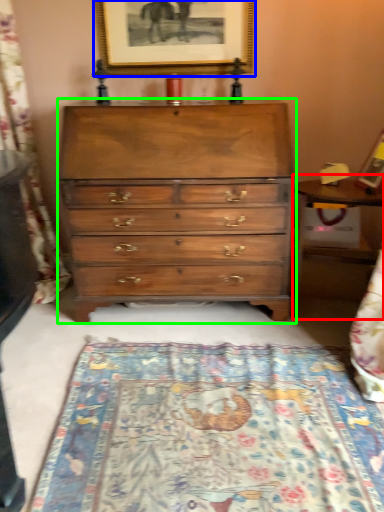
Question: Based on their relative distances, which object is nearer to table (highlighted by a red box)? Choose from picture frame (highlighted by a blue box) and chest of drawers (highlighted by a green box).

Choices:
 (A) picture frame
 (B) chest of drawers

Answer: (B)